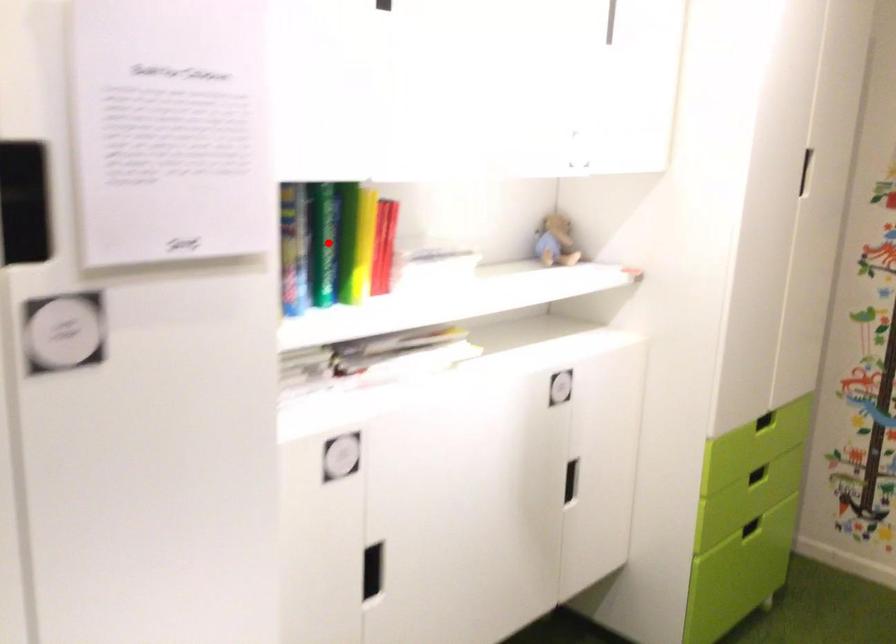
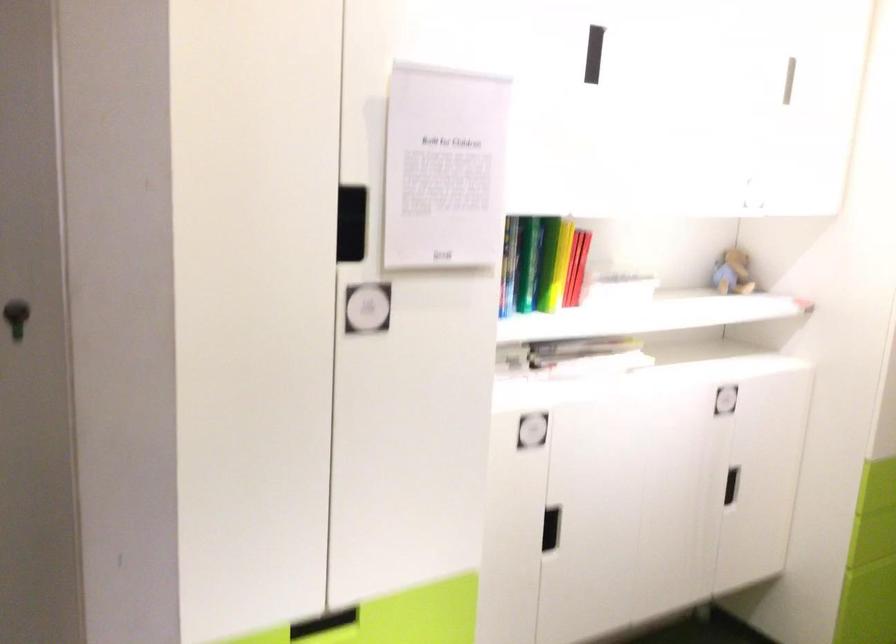
Question: I am providing you with two images of the same scene from different viewpoints. A red point is shown in image1. For the corresponding object point in image2, is it positioned nearer or farther from the camera?

Choices:
 (A) Nearer
 (B) Farther

Answer: (B)